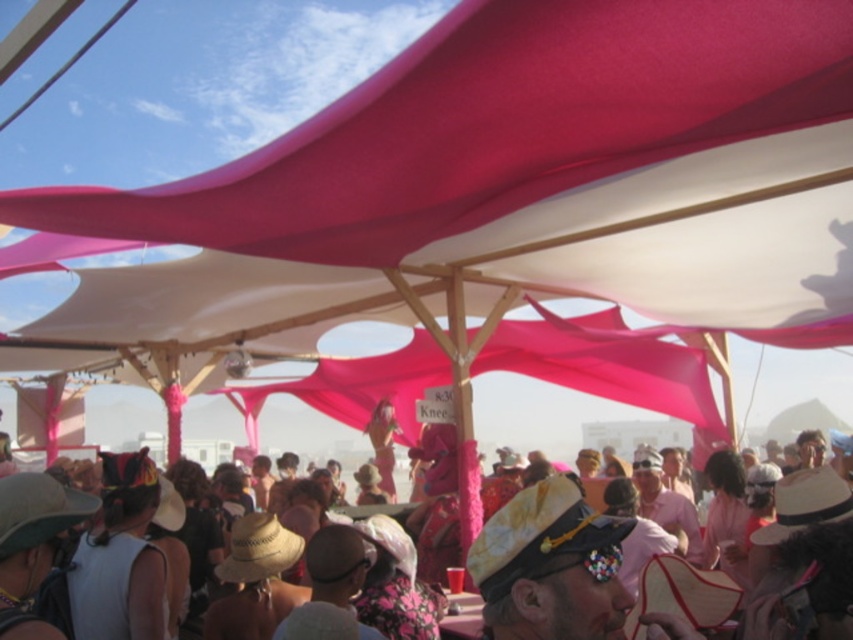
Can you confirm if matte pink fabric canopy at upper center is positioned below pink fabric canopy at center?

No, matte pink fabric canopy at upper center is not below pink fabric canopy at center.

Is matte pink fabric canopy at upper center in front of pink fabric canopy at center?

No, matte pink fabric canopy at upper center is behind pink fabric canopy at center.

Is point (605, 77) behind point (780, 488)?

No, (605, 77) is in front of (780, 488).

The height and width of the screenshot is (640, 853). I want to click on matte pink fabric canopy at upper center, so click(527, 170).